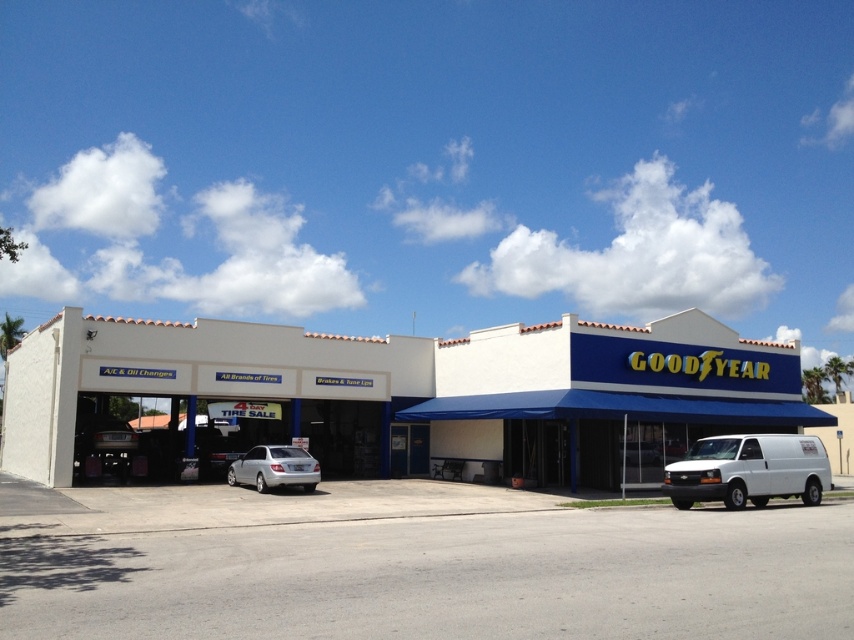
Question: Among these points, which one is nearest to the camera?

Choices:
 (A) (264, 448)
 (B) (234, 602)
 (C) (294, 330)
 (D) (736, 458)

Answer: (B)

Question: Is gray asphalt parking lot at center to the right of white matte van at lower right from the viewer's perspective?

Choices:
 (A) no
 (B) yes

Answer: (A)

Question: From the image, what is the correct spatial relationship of white matte van at lower right in relation to silver metallic sedan at center?

Choices:
 (A) above
 (B) below

Answer: (A)

Question: Which point appears farthest from the camera in this image?

Choices:
 (A) (781, 465)
 (B) (732, 524)
 (C) (272, 456)

Answer: (C)

Question: Does white matte building at center appear on the right side of white matte van at lower right?

Choices:
 (A) yes
 (B) no

Answer: (B)

Question: Which object is the farthest from the gray asphalt parking lot at center?

Choices:
 (A) white matte van at lower right
 (B) white matte building at center
 (C) silver metallic sedan at center

Answer: (A)